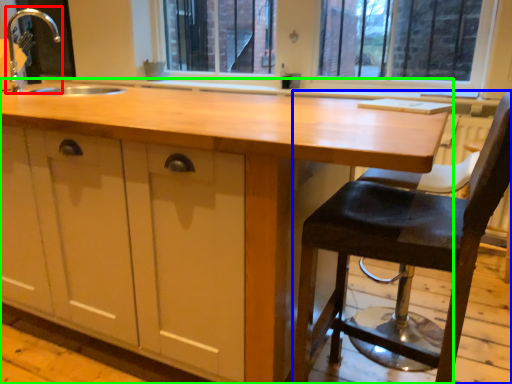
Question: Which object is positioned farthest from faucet (highlighted by a red box)? Select from chair (highlighted by a blue box) and countertop (highlighted by a green box).

Choices:
 (A) chair
 (B) countertop

Answer: (A)